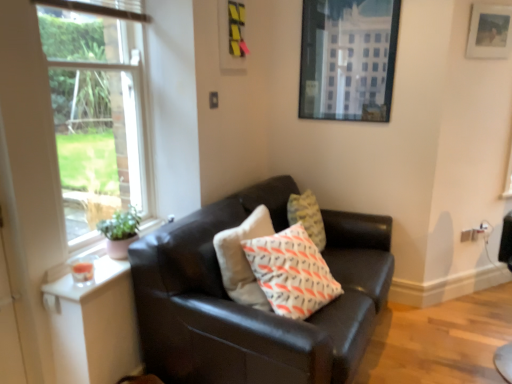
Question: Can you confirm if wooden picture frame at upper right, which appears as the 1th picture frame when viewed from the right, is bigger than metallic glass picture frame at upper right, marked as the 1th picture frame in a left-to-right arrangement?

Choices:
 (A) no
 (B) yes

Answer: (A)

Question: Does wooden picture frame at upper right, marked as the second picture frame in a left-to-right arrangement, appear on the right side of metallic glass picture frame at upper right, the 2th picture frame viewed from the right?

Choices:
 (A) no
 (B) yes

Answer: (B)

Question: From the image's perspective, is wooden picture frame at upper right, which appears as the 1th picture frame when viewed from the right, under metallic glass picture frame at upper right, marked as the 1th picture frame in a left-to-right arrangement?

Choices:
 (A) no
 (B) yes

Answer: (A)

Question: From a real-world perspective, is wooden picture frame at upper right, marked as the second picture frame in a left-to-right arrangement, located beneath metallic glass picture frame at upper right, marked as the 1th picture frame in a left-to-right arrangement?

Choices:
 (A) yes
 (B) no

Answer: (B)

Question: Can you confirm if wooden picture frame at upper right, marked as the second picture frame in a left-to-right arrangement, is taller than metallic glass picture frame at upper right, the 2th picture frame viewed from the right?

Choices:
 (A) yes
 (B) no

Answer: (B)

Question: Does wooden picture frame at upper right, which appears as the 1th picture frame when viewed from the right, have a greater width compared to metallic glass picture frame at upper right, marked as the 1th picture frame in a left-to-right arrangement?

Choices:
 (A) yes
 (B) no

Answer: (B)

Question: Is metallic glass picture frame at upper right, the 2th picture frame viewed from the right, outside of white cotton pillow at center?

Choices:
 (A) yes
 (B) no

Answer: (A)

Question: From a real-world perspective, is metallic glass picture frame at upper right, marked as the 1th picture frame in a left-to-right arrangement, under white cotton pillow at center?

Choices:
 (A) no
 (B) yes

Answer: (A)

Question: Is the surface of metallic glass picture frame at upper right, the 2th picture frame viewed from the right, in direct contact with white cotton pillow at center?

Choices:
 (A) no
 (B) yes

Answer: (A)

Question: From the image's perspective, is metallic glass picture frame at upper right, the 2th picture frame viewed from the right, over white cotton pillow at center?

Choices:
 (A) yes
 (B) no

Answer: (A)

Question: Does metallic glass picture frame at upper right, marked as the 1th picture frame in a left-to-right arrangement, contain white cotton pillow at center?

Choices:
 (A) no
 (B) yes

Answer: (A)

Question: From the image's perspective, is metallic glass picture frame at upper right, the 2th picture frame viewed from the right, below white cotton pillow at center?

Choices:
 (A) no
 (B) yes

Answer: (A)

Question: From a real-world perspective, is white cotton pillow at center located beneath matte black couch at center?

Choices:
 (A) yes
 (B) no

Answer: (B)